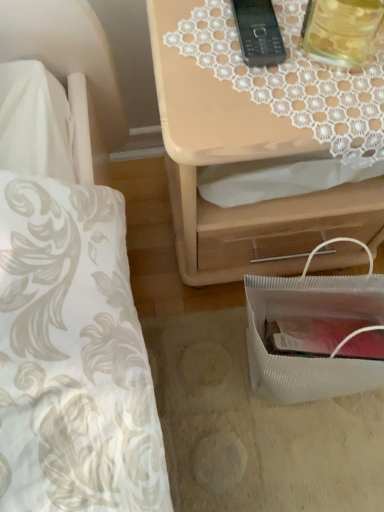
You are a GUI agent. You are given a task and a screenshot of the screen. Output one action in this format:
    pyautogui.click(x=<x>, y=<y>)
    Task: Click on the free space in front of translucent glass jar at upper right
    Image resolution: width=384 pixels, height=512 pixels.
    Given the screenshot: What is the action you would take?
    pyautogui.click(x=327, y=105)